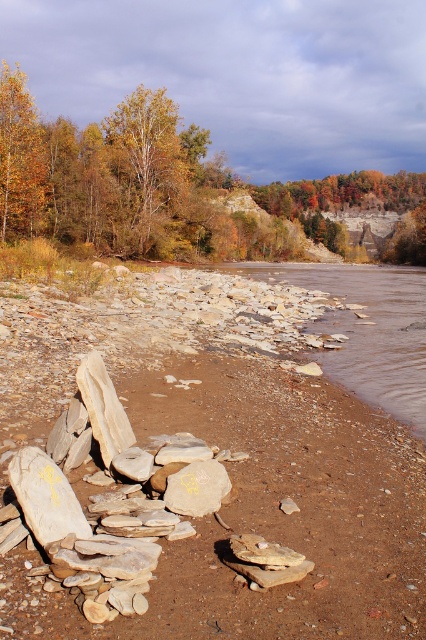
Does golden-brown bark tree at center come in front of golden yellow leaves at upper left?

No, golden-brown bark tree at center is further to the viewer.

Who is more distant from viewer, (x=144, y=205) or (x=20, y=113)?

The point (x=144, y=205) is more distant.

Identify the location of golden-brown bark tree at center. The width and height of the screenshot is (426, 640). tap(146, 163).

You are a GUI agent. You are given a task and a screenshot of the screen. Output one action in this format:
    pyautogui.click(x=<x>, y=<y>)
    Task: Click on the golden-brown bark tree at center
    Image resolution: width=426 pixels, height=640 pixels.
    Given the screenshot: What is the action you would take?
    pyautogui.click(x=146, y=163)

Is smooth stone rocks at center thinner than golden yellow leaves at upper left?

Indeed, smooth stone rocks at center has a lesser width compared to golden yellow leaves at upper left.

Is smooth stone rocks at center wider than golden yellow leaves at upper left?

No.

Who is more distant from viewer, (238, 593) or (11, 113)?

Point (11, 113)

What are the coordinates of `smooth stone rocks at center` in the screenshot? It's located at (226, 461).

The width and height of the screenshot is (426, 640). I want to click on smooth stone rocks at center, so click(x=226, y=461).

Is smooth stone rocks at center above golden-brown bark tree at center?

No.

Is point (328, 632) positioned before point (152, 145)?

That is True.

The height and width of the screenshot is (640, 426). What are the coordinates of `smooth stone rocks at center` in the screenshot? It's located at (226, 461).